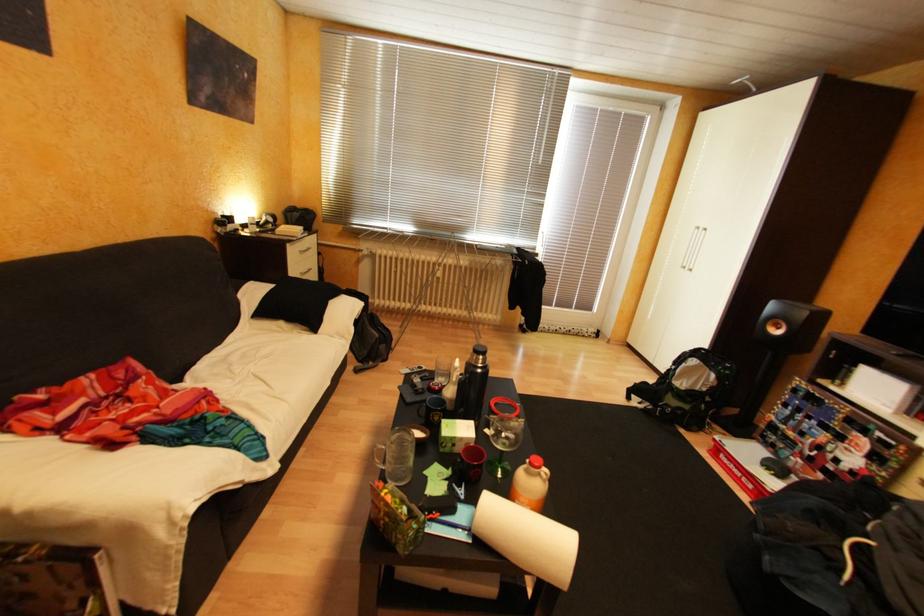
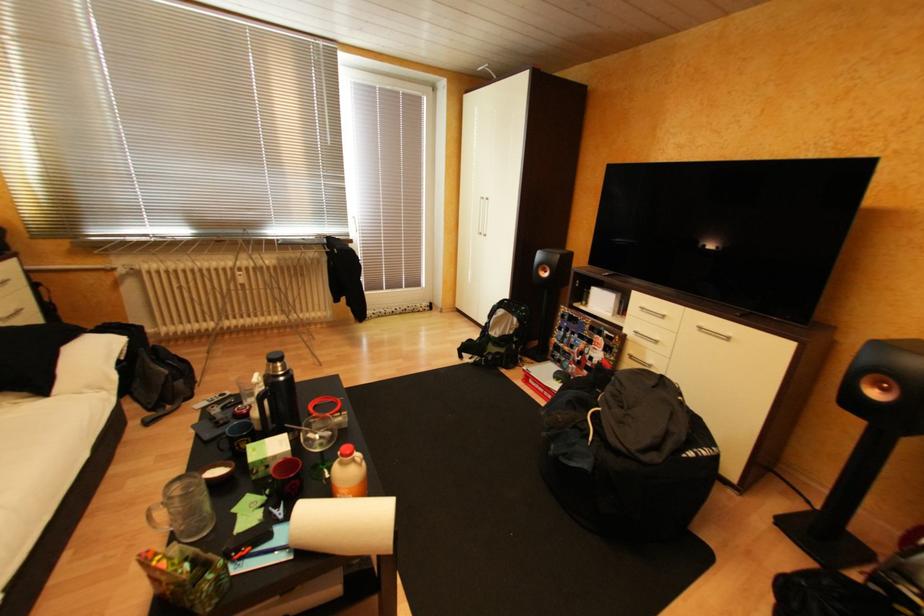
Question: The camera is either moving clockwise (left) or counter-clockwise (right) around the object. The first image is from the beginning of the video and the second image is from the end. Is the camera moving left or right when shooting the video?

Choices:
 (A) Left
 (B) Right

Answer: (A)